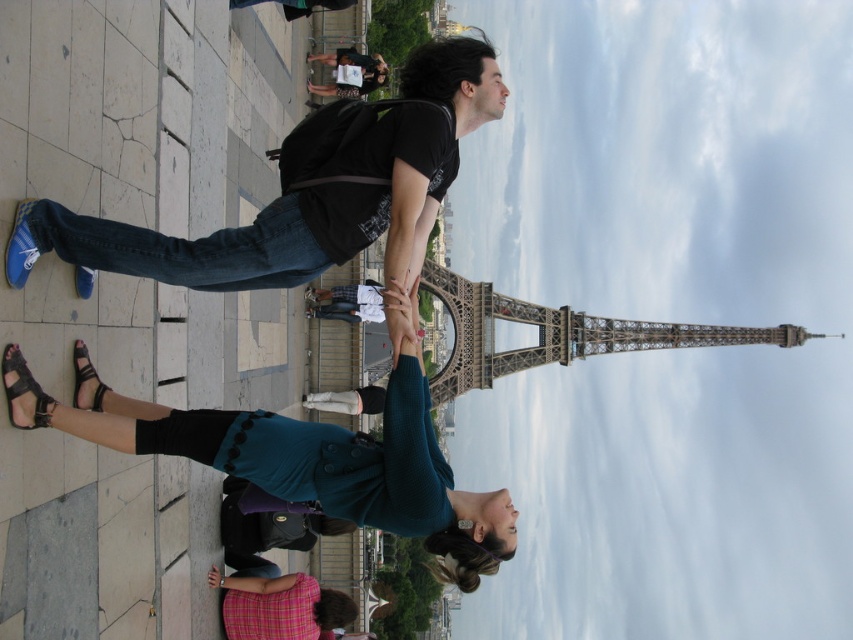
Question: Does teal fabric sweater at lower center have a smaller size compared to gray metal eiffel tower at center?

Choices:
 (A) yes
 (B) no

Answer: (A)

Question: Which object is closer to the camera taking this photo?

Choices:
 (A) pink plaid shirt at lower center
 (B) blue denim jeans at left
 (C) teal fabric sweater at lower center

Answer: (C)

Question: Is blue denim jeans at left positioned behind teal fabric sweater at lower center?

Choices:
 (A) no
 (B) yes

Answer: (B)

Question: Does teal fabric sweater at lower center have a larger size compared to pink plaid shirt at lower center?

Choices:
 (A) yes
 (B) no

Answer: (A)

Question: Which of the following is the farthest from the observer?

Choices:
 (A) (267, 276)
 (B) (273, 602)
 (C) (584, 321)
 (D) (83, 406)

Answer: (C)

Question: Which object is farther from the camera taking this photo?

Choices:
 (A) teal fabric sweater at lower center
 (B) gray metal eiffel tower at center

Answer: (B)